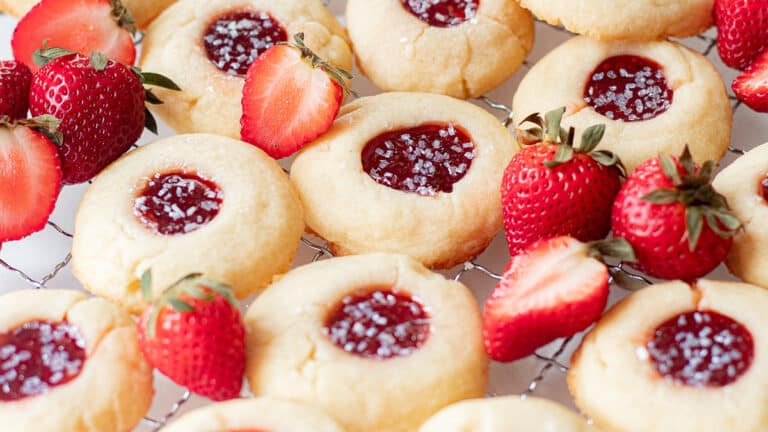
Find the location of `rack`. rack is located at coordinates coord(484,275).